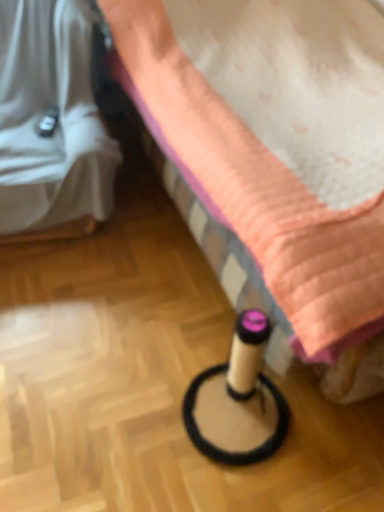
Where is `vacant region to the right of white fabric at left, the first furniture from the left`? The height and width of the screenshot is (512, 384). vacant region to the right of white fabric at left, the first furniture from the left is located at coordinates (159, 231).